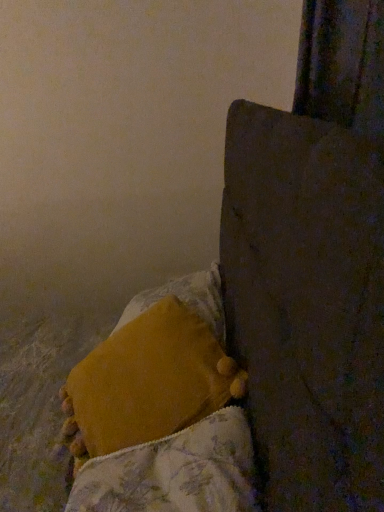
Question: Should I look upward or downward to see velvety yellow pillow at lower center?

Choices:
 (A) down
 (B) up

Answer: (A)

Question: Could you tell me if velvety yellow pillow at lower center is facing fluffy yellow blanket at lower left?

Choices:
 (A) no
 (B) yes

Answer: (A)

Question: From a real-world perspective, is velvety yellow pillow at lower center located higher than fluffy yellow blanket at lower left?

Choices:
 (A) no
 (B) yes

Answer: (B)

Question: Is velvety yellow pillow at lower center closer to camera compared to fluffy yellow blanket at lower left?

Choices:
 (A) yes
 (B) no

Answer: (B)

Question: Is velvety yellow pillow at lower center to the right of fluffy yellow blanket at lower left from the viewer's perspective?

Choices:
 (A) no
 (B) yes

Answer: (A)

Question: Can you confirm if velvety yellow pillow at lower center is bigger than fluffy yellow blanket at lower left?

Choices:
 (A) no
 (B) yes

Answer: (B)

Question: Is velvety yellow pillow at lower center in contact with fluffy yellow blanket at lower left?

Choices:
 (A) no
 (B) yes

Answer: (A)

Question: Is velvety yellow pillow at lower center further to camera compared to wooden bedpost at upper right?

Choices:
 (A) no
 (B) yes

Answer: (B)

Question: Is velvety yellow pillow at lower center thinner than wooden bedpost at upper right?

Choices:
 (A) yes
 (B) no

Answer: (A)

Question: From the image's perspective, is velvety yellow pillow at lower center on top of wooden bedpost at upper right?

Choices:
 (A) no
 (B) yes

Answer: (A)

Question: Does velvety yellow pillow at lower center contain wooden bedpost at upper right?

Choices:
 (A) no
 (B) yes

Answer: (A)

Question: Is velvety yellow pillow at lower center taller than wooden bedpost at upper right?

Choices:
 (A) no
 (B) yes

Answer: (A)

Question: From the image's perspective, would you say velvety yellow pillow at lower center is shown under wooden bedpost at upper right?

Choices:
 (A) no
 (B) yes

Answer: (B)

Question: From a real-world perspective, is fluffy yellow blanket at lower left beneath velvety yellow pillow at lower center?

Choices:
 (A) yes
 (B) no

Answer: (A)